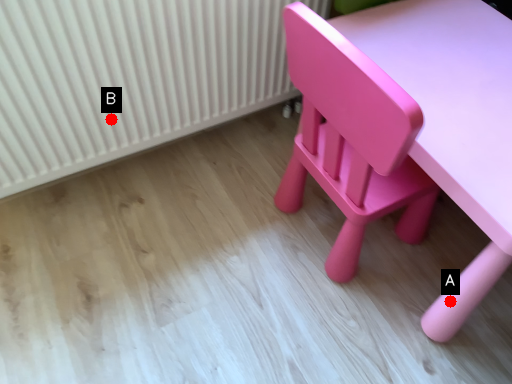
Question: Two points are circled on the image, labeled by A and B beside each circle. Which of the following is the closest to the observer?

Choices:
 (A) A is closer
 (B) B is closer

Answer: (A)